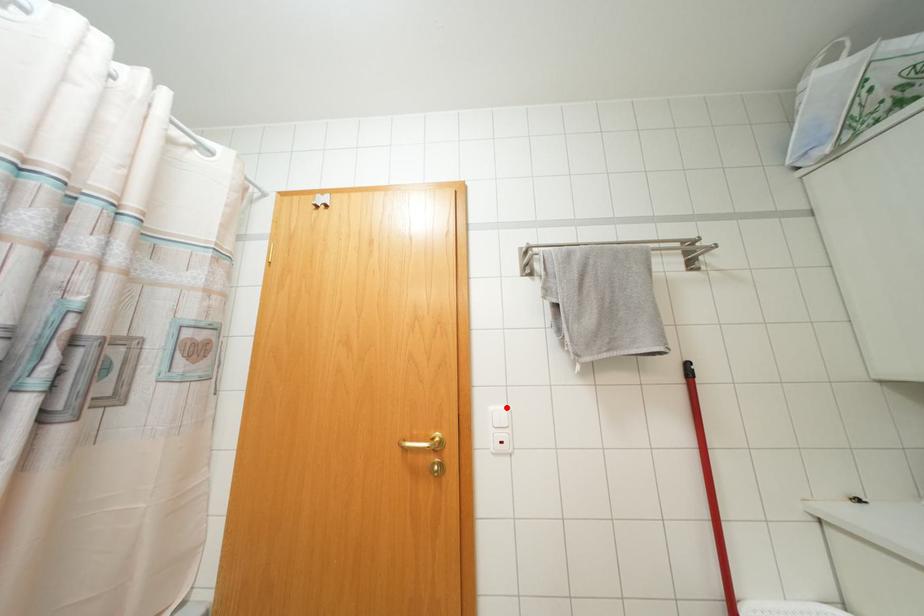
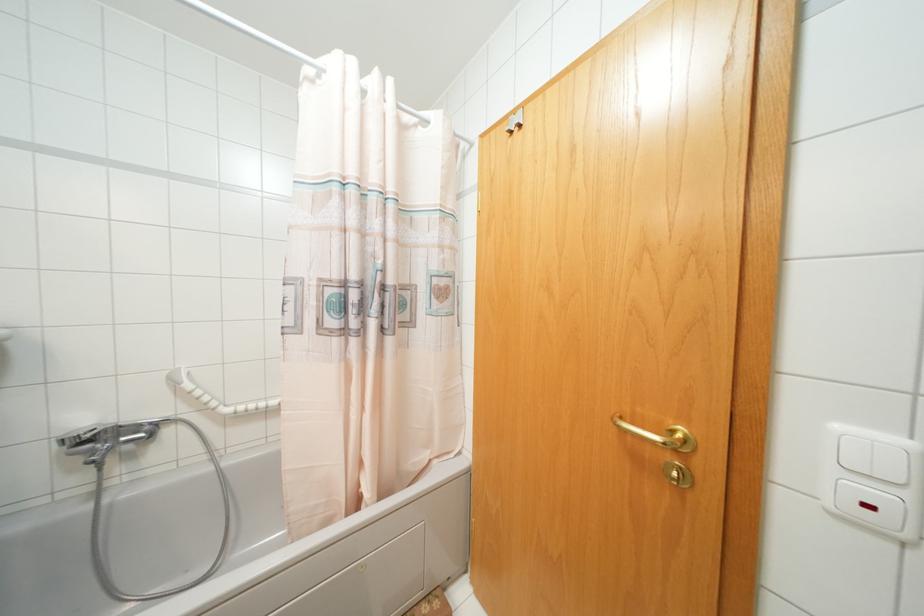
Where in the second image is the point corresponding to the highlighted location from the first image?

(906, 442)